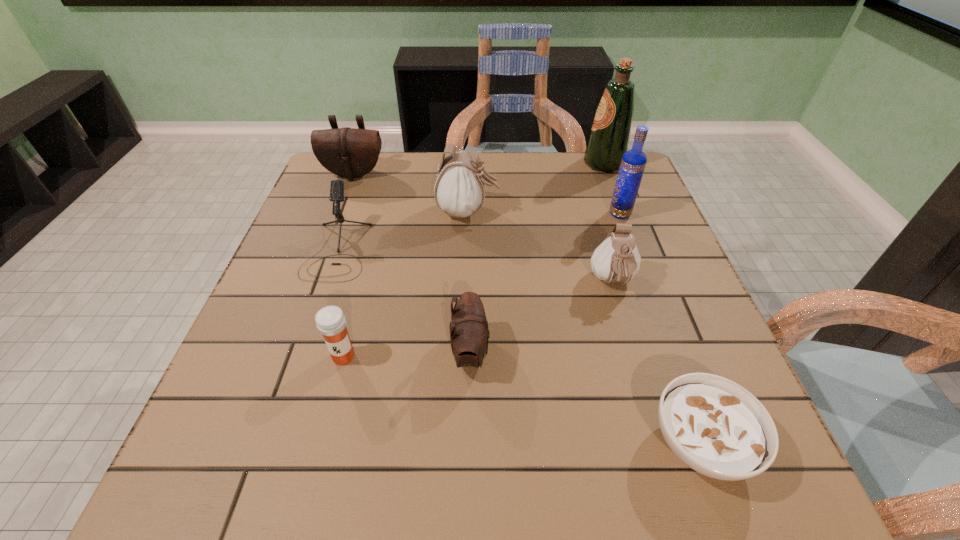
At what (x,y) coordinates should I click in order to perform the action: click on microphone positioned at the left edge. Please return your answer as a coordinate pair (x, y). Looking at the image, I should click on (337, 186).

At what (x,y) coordinates should I click in order to perform the action: click on olive oil located in the right edge section of the desktop. Please return your answer as a coordinate pair (x, y). The image size is (960, 540). Looking at the image, I should click on (609, 138).

At what (x,y) coordinates should I click in order to perform the action: click on vodka that is at the right edge. Please return your answer as a coordinate pair (x, y). This screenshot has height=540, width=960. Looking at the image, I should click on (633, 163).

What are the coordinates of `pouch present at the right edge` in the screenshot? It's located at (616, 260).

Identify the location of soup bowl situated at the right edge. (715, 426).

At what (x,y) coordinates should I click in order to perform the action: click on object that is at the far left corner. Please return your answer as a coordinate pair (x, y). Image resolution: width=960 pixels, height=540 pixels. Looking at the image, I should click on (347, 152).

Identify the location of object present at the far right corner. Image resolution: width=960 pixels, height=540 pixels. (609, 138).

Where is `object at the near right corner`? The width and height of the screenshot is (960, 540). object at the near right corner is located at coordinates (715, 426).

In the image, there is a desktop. Where is `vacant region at the far edge`? The width and height of the screenshot is (960, 540). vacant region at the far edge is located at coordinates (541, 177).

In the image, there is a desktop. Where is `vacant space at the near edge`? The height and width of the screenshot is (540, 960). vacant space at the near edge is located at coordinates (568, 465).